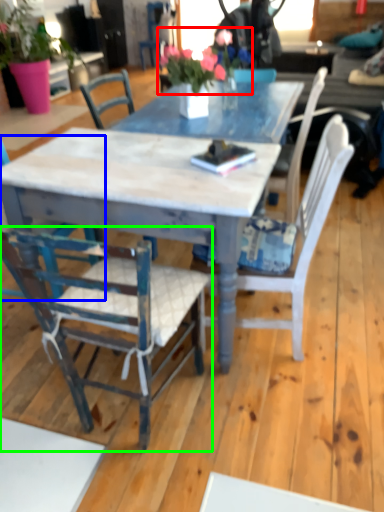
Question: Considering the real-world distances, which object is farthest from floral arrangement (highlighted by a red box)? chair (highlighted by a blue box) or chair (highlighted by a green box)?

Choices:
 (A) chair
 (B) chair

Answer: (B)